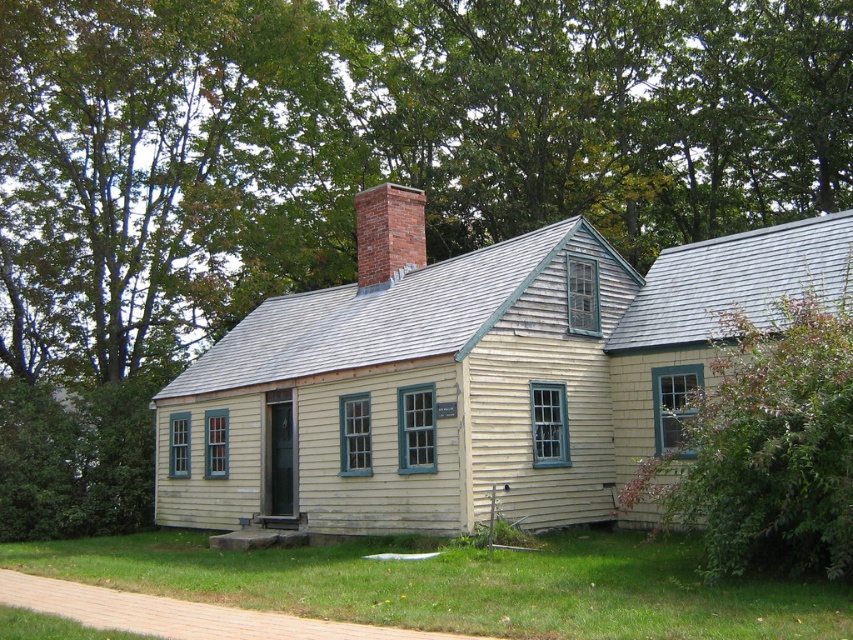
Question: Which point is closer to the camera?

Choices:
 (A) (730, 326)
 (B) (421, 216)

Answer: (A)

Question: Does green leafy bush at right have a smaller size compared to brick chimney at center?

Choices:
 (A) yes
 (B) no

Answer: (A)

Question: Does green leafy bush at right lie behind brick chimney at center?

Choices:
 (A) no
 (B) yes

Answer: (A)

Question: Can you confirm if green leafy bush at right is bigger than brick chimney at center?

Choices:
 (A) yes
 (B) no

Answer: (B)